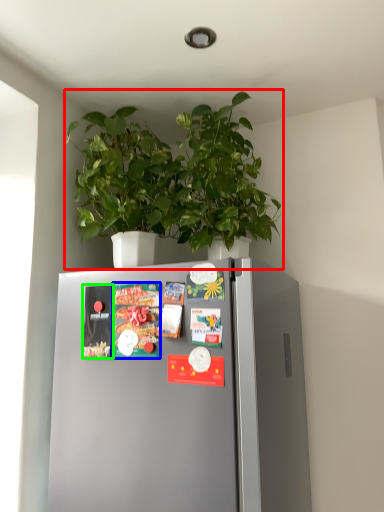
Question: Based on their relative distances, which object is farther from houseplant (highlighted by a red box)? Choose from magazine (highlighted by a blue box) and magazine (highlighted by a green box).

Choices:
 (A) magazine
 (B) magazine

Answer: (B)